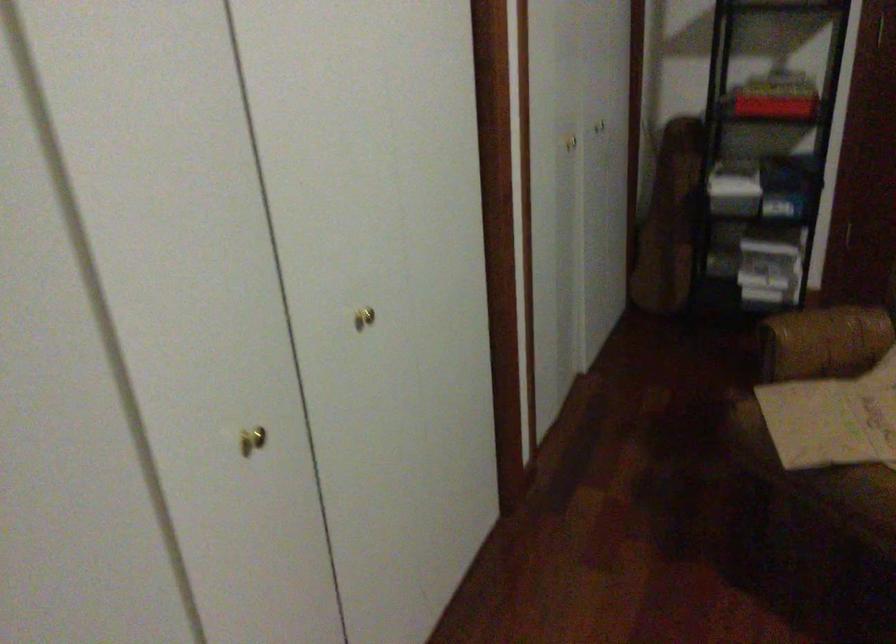
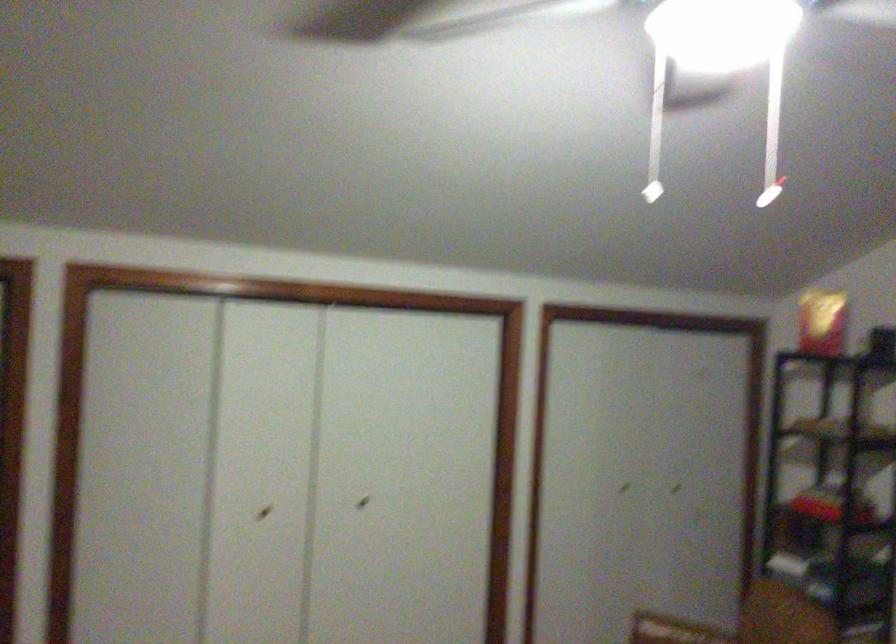
The point at (573, 131) is marked in the first image. Where is the corresponding point in the second image?

(623, 488)